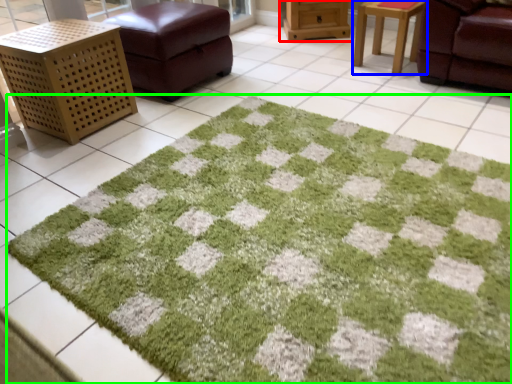
Question: Based on their relative distances, which object is nearer to furniture (highlighted by a red box)? Choose from table (highlighted by a blue box) and bath mat (highlighted by a green box).

Choices:
 (A) table
 (B) bath mat

Answer: (A)